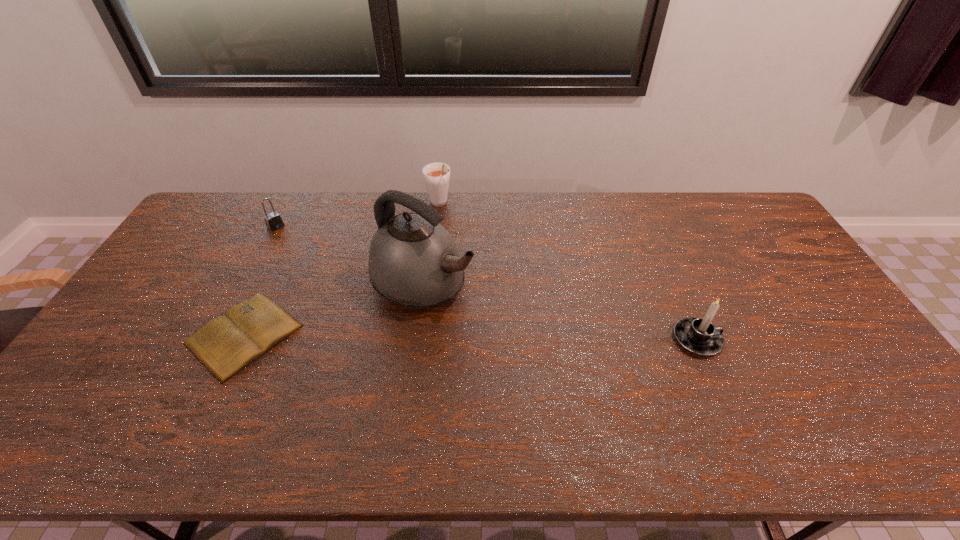
The image size is (960, 540). What are the coordinates of `free point between the farthest object and the fourth tallest object` in the screenshot? It's located at (357, 215).

Where is `vacant space that's between the kettle and the book`? The width and height of the screenshot is (960, 540). vacant space that's between the kettle and the book is located at coordinates (334, 309).

Identify the location of unoccupied position between the farthest object and the rightmost object. Image resolution: width=960 pixels, height=540 pixels. (568, 272).

You are a GUI agent. You are given a task and a screenshot of the screen. Output one action in this format:
    pyautogui.click(x=<x>, y=<y>)
    Task: Click on the free spot between the rightmost object and the farthest object
    The image size is (960, 540).
    Given the screenshot: What is the action you would take?
    pyautogui.click(x=568, y=272)

Identify which object is located as the fourth nearest to the tallest object. Please provide its 2D coordinates. Your answer should be formatted as a tuple, i.e. [(x, y)], where the tuple contains the x and y coordinates of a point satisfying the conditions above.

[(699, 336)]

Identify which object is the second closest to the shortest object. Please provide its 2D coordinates. Your answer should be formatted as a tuple, i.e. [(x, y)], where the tuple contains the x and y coordinates of a point satisfying the conditions above.

[(273, 221)]

Identify the location of free space that satisfies the following two spatial constraints: 1. on the front side of the candle holder; 2. with a handle on the side of the shortest object. This screenshot has height=540, width=960. (242, 339).